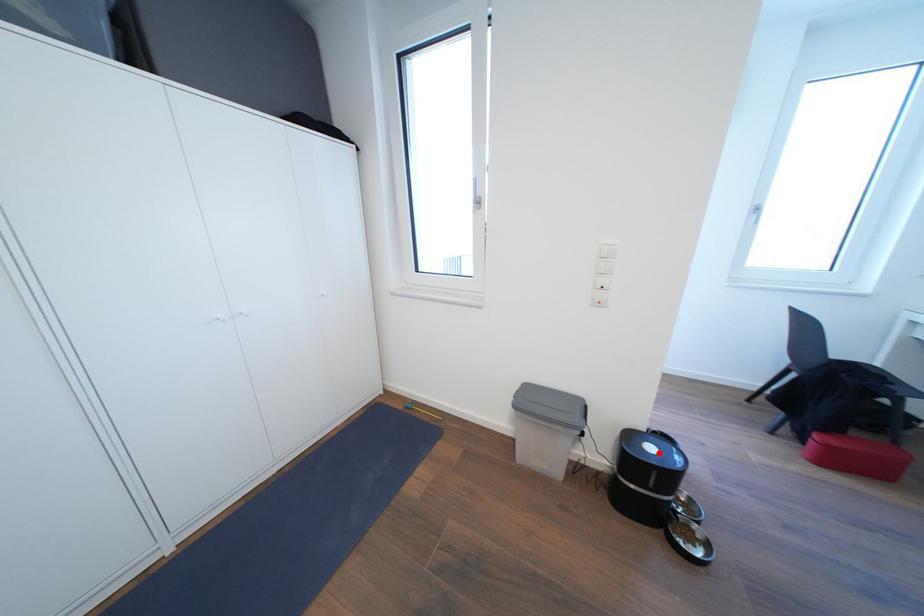
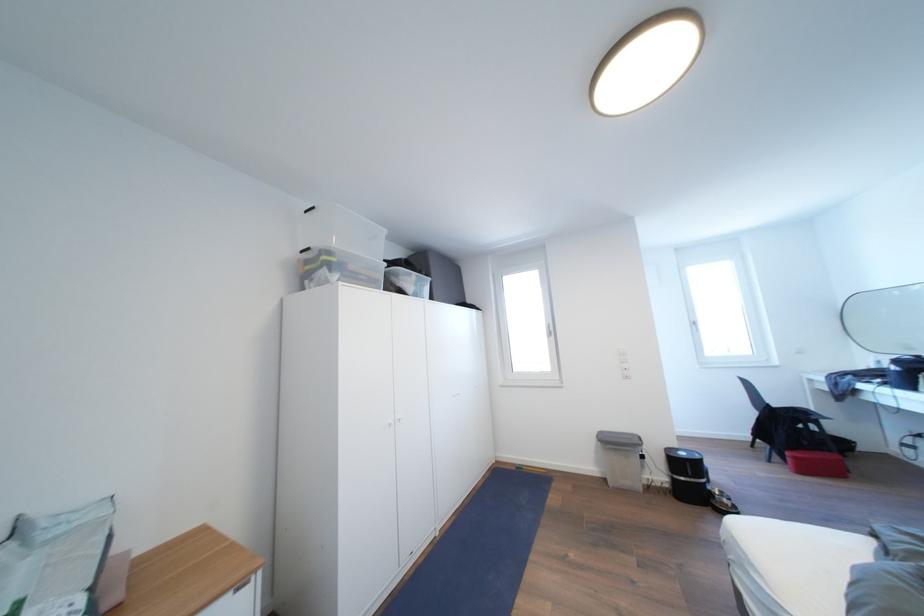
Where in the second image is the point corresponding to the highlighted location from the first image?

(689, 459)